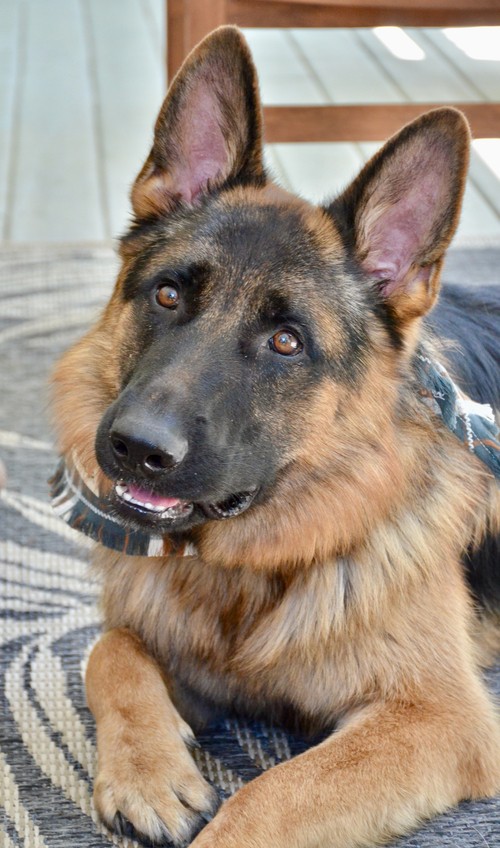
The width and height of the screenshot is (500, 848). Identify the location of rug. (45, 617).